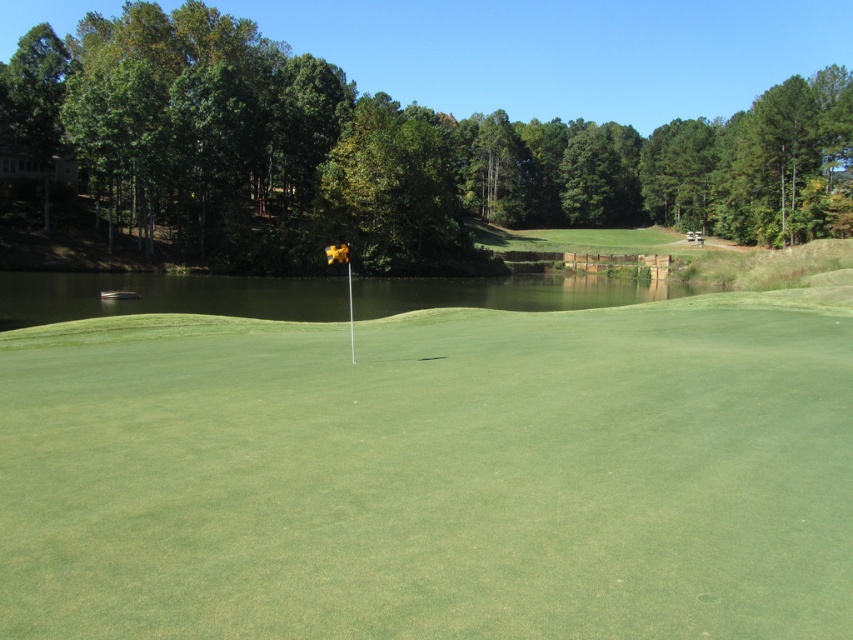
Is point (839, 611) behind point (660, 284)?

That is False.

In the scene shown: Can you confirm if green grassy golf course at center is smaller than greenish water at center?

Correct, green grassy golf course at center occupies less space than greenish water at center.

Is point (254, 436) positioned after point (86, 316)?

No, (254, 436) is closer to viewer.

This screenshot has height=640, width=853. Find the location of `green grassy golf course at center`. green grassy golf course at center is located at coordinates (431, 474).